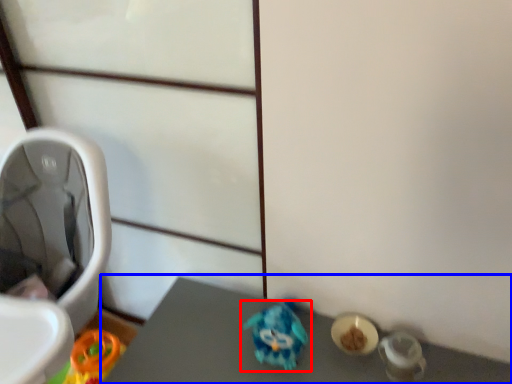
Question: Which object is further to the camera taking this photo, toy (highlighted by a red box) or vanity (highlighted by a blue box)?

Choices:
 (A) toy
 (B) vanity

Answer: (A)